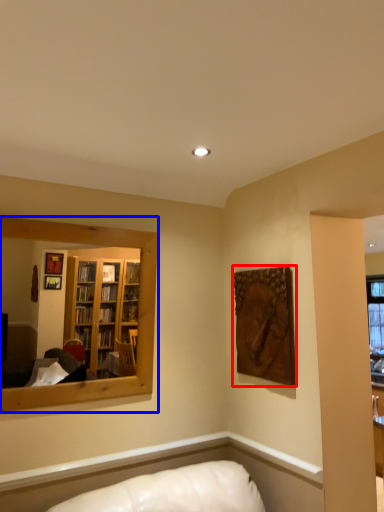
Question: Which of the following is the farthest to the observer, picture frame (highlighted by a red box) or mirror (highlighted by a blue box)?

Choices:
 (A) picture frame
 (B) mirror

Answer: (A)